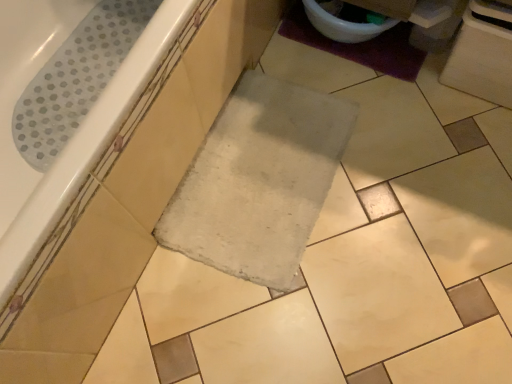
Question: From a real-world perspective, is white glossy toilet bowl at upper right positioned under purple fuzzy bath mat at upper right based on gravity?

Choices:
 (A) no
 (B) yes

Answer: (A)

Question: Can we say white glossy toilet bowl at upper right lies outside purple fuzzy bath mat at upper right?

Choices:
 (A) yes
 (B) no

Answer: (A)

Question: Can purple fuzzy bath mat at upper right be found inside white glossy toilet bowl at upper right?

Choices:
 (A) no
 (B) yes

Answer: (A)

Question: Is white glossy toilet bowl at upper right at the right side of purple fuzzy bath mat at upper right?

Choices:
 (A) no
 (B) yes

Answer: (A)

Question: Could you tell me if white glossy toilet bowl at upper right is facing purple fuzzy bath mat at upper right?

Choices:
 (A) yes
 (B) no

Answer: (B)

Question: Is the depth of white glossy toilet bowl at upper right greater than that of purple fuzzy bath mat at upper right?

Choices:
 (A) no
 (B) yes

Answer: (A)

Question: Is white glossy toilet bowl at upper right touching white glossy bathtub at upper left?

Choices:
 (A) yes
 (B) no

Answer: (B)

Question: Would you say white glossy toilet bowl at upper right is outside white glossy bathtub at upper left?

Choices:
 (A) yes
 (B) no

Answer: (A)

Question: Can white glossy bathtub at upper left be found inside white glossy toilet bowl at upper right?

Choices:
 (A) yes
 (B) no

Answer: (B)

Question: Is white glossy toilet bowl at upper right positioned behind white glossy bathtub at upper left?

Choices:
 (A) no
 (B) yes

Answer: (B)

Question: Can you confirm if white glossy toilet bowl at upper right is bigger than white glossy bathtub at upper left?

Choices:
 (A) no
 (B) yes

Answer: (A)

Question: From the image's perspective, is white glossy toilet bowl at upper right located above white glossy bathtub at upper left?

Choices:
 (A) no
 (B) yes

Answer: (B)

Question: Does white glossy bathtub at upper left have a lesser height compared to white glossy toilet bowl at upper right?

Choices:
 (A) yes
 (B) no

Answer: (B)